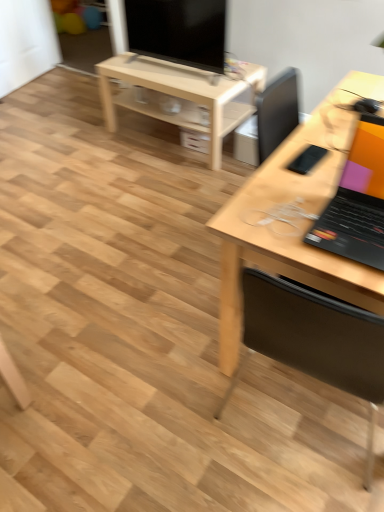
Question: From the image's perspective, does light wood/unfinished table at center appear lower than black matte laptop at right?

Choices:
 (A) yes
 (B) no

Answer: (B)

Question: Considering the relative positions of light wood/unfinished table at center and black matte laptop at right in the image provided, is light wood/unfinished table at center behind black matte laptop at right?

Choices:
 (A) no
 (B) yes

Answer: (B)

Question: Is there a large distance between light wood/unfinished table at center and black matte laptop at right?

Choices:
 (A) yes
 (B) no

Answer: (A)

Question: Is light wood/unfinished table at center surrounding black matte laptop at right?

Choices:
 (A) yes
 (B) no

Answer: (B)

Question: Can you confirm if light wood/unfinished table at center is wider than black matte laptop at right?

Choices:
 (A) no
 (B) yes

Answer: (B)

Question: Considering the relative sizes of light wood/unfinished table at center and black matte laptop at right in the image provided, is light wood/unfinished table at center bigger than black matte laptop at right?

Choices:
 (A) no
 (B) yes

Answer: (B)

Question: Is the position of light wood/unfinished table at center more distant than that of matte black tv at upper center?

Choices:
 (A) no
 (B) yes

Answer: (B)

Question: Is light wood/unfinished table at center at the right side of matte black tv at upper center?

Choices:
 (A) yes
 (B) no

Answer: (A)

Question: Could you tell me if light wood/unfinished table at center is turned towards matte black tv at upper center?

Choices:
 (A) yes
 (B) no

Answer: (B)

Question: Is light wood/unfinished table at center outside matte black tv at upper center?

Choices:
 (A) no
 (B) yes

Answer: (B)

Question: Considering the relative sizes of light wood/unfinished table at center and matte black tv at upper center in the image provided, is light wood/unfinished table at center taller than matte black tv at upper center?

Choices:
 (A) yes
 (B) no

Answer: (A)

Question: Considering the relative sizes of light wood/unfinished table at center and matte black tv at upper center in the image provided, is light wood/unfinished table at center shorter than matte black tv at upper center?

Choices:
 (A) no
 (B) yes

Answer: (A)

Question: From a real-world perspective, does matte black tv at upper center sit lower than wooden chair at right?

Choices:
 (A) yes
 (B) no

Answer: (B)